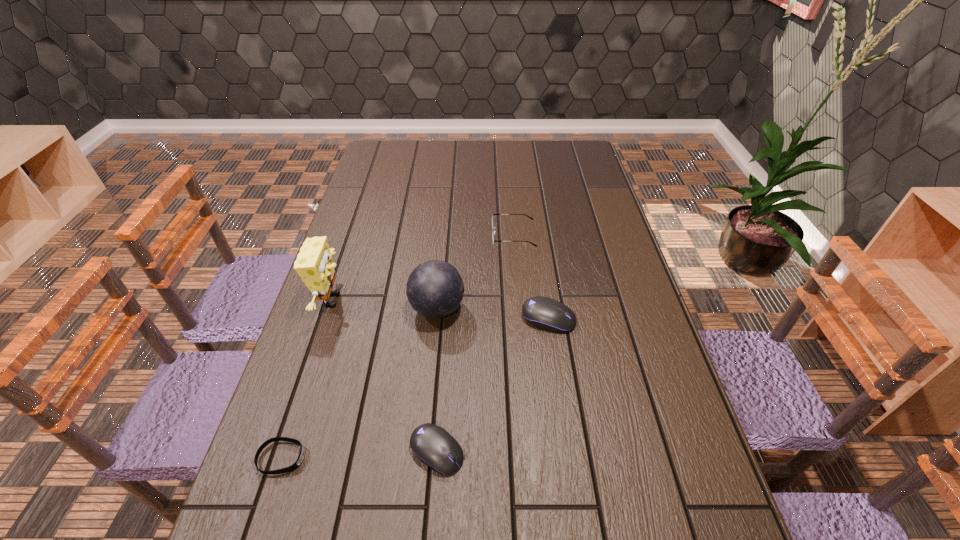
Where is `free area in between the sponge and the shortest object`? The height and width of the screenshot is (540, 960). free area in between the sponge and the shortest object is located at coordinates (306, 379).

Find the location of a particular element. The height and width of the screenshot is (540, 960). free spot between the left computer mouse and the tallest object is located at coordinates (384, 375).

The image size is (960, 540). Find the location of `free point between the taller computer mouse and the bowling ball`. free point between the taller computer mouse and the bowling ball is located at coordinates (492, 314).

Find the location of a particular element. Image resolution: width=960 pixels, height=540 pixels. vacant space in between the right computer mouse and the bowling ball is located at coordinates pos(492,314).

The width and height of the screenshot is (960, 540). I want to click on free space between the bowling ball and the shortest object, so click(359, 383).

I want to click on object identified as the fourth closest to the farthest object, so click(x=433, y=445).

What are the coordinates of `the closest object relative to the second tallest object` in the screenshot? It's located at (545, 313).

Locate an element on the screen. vacant region that satisfies the following two spatial constraints: 1. on the back side of the shorter computer mouse; 2. on the right side of the farther computer mouse is located at coordinates (446, 318).

Where is `free space that satisfies the following two spatial constraints: 1. on the face of the taller computer mouse; 2. on the left side of the sponge`? free space that satisfies the following two spatial constraints: 1. on the face of the taller computer mouse; 2. on the left side of the sponge is located at coordinates (325, 318).

Identify the location of vacant space that satisfies the following two spatial constraints: 1. on the back side of the nearer computer mouse; 2. on the face of the tallest object. The image size is (960, 540). (447, 300).